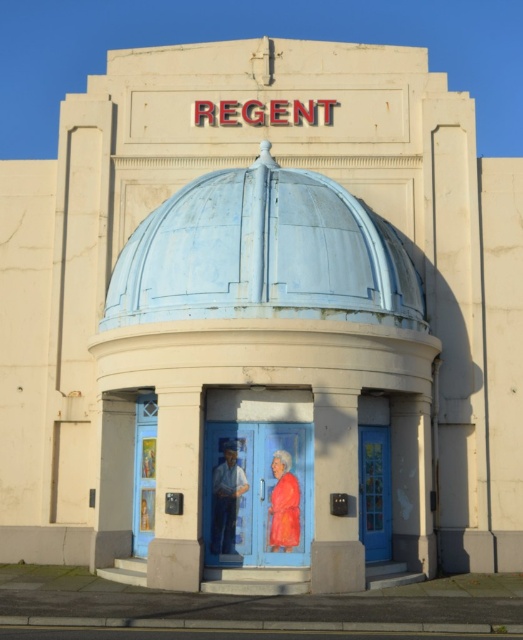
Question: Can you confirm if blue painted door at center is positioned to the right of blue glass door at center?

Choices:
 (A) no
 (B) yes

Answer: (A)

Question: Which object appears closest to the camera in this image?

Choices:
 (A) matte blue statue at center
 (B) orange velvet robe at center

Answer: (B)

Question: Which of the following is the closest to the observer?

Choices:
 (A) (219, 528)
 (B) (288, 228)
 (C) (236, 502)

Answer: (A)

Question: Which of the following is the closest to the observer?

Choices:
 (A) (234, 451)
 (B) (289, 492)
 (C) (379, 460)
 (D) (118, 259)

Answer: (B)

Question: Does light blue metallic dome at center have a smaller size compared to blue painted door at center?

Choices:
 (A) no
 (B) yes

Answer: (A)

Question: Does blue painted door at center appear on the left side of orange velvet robe at center?

Choices:
 (A) no
 (B) yes

Answer: (B)